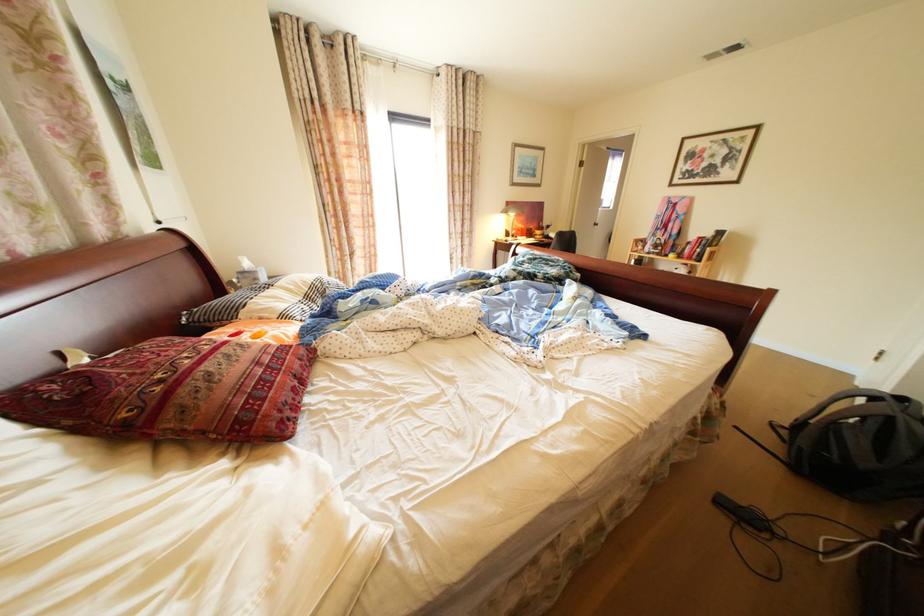
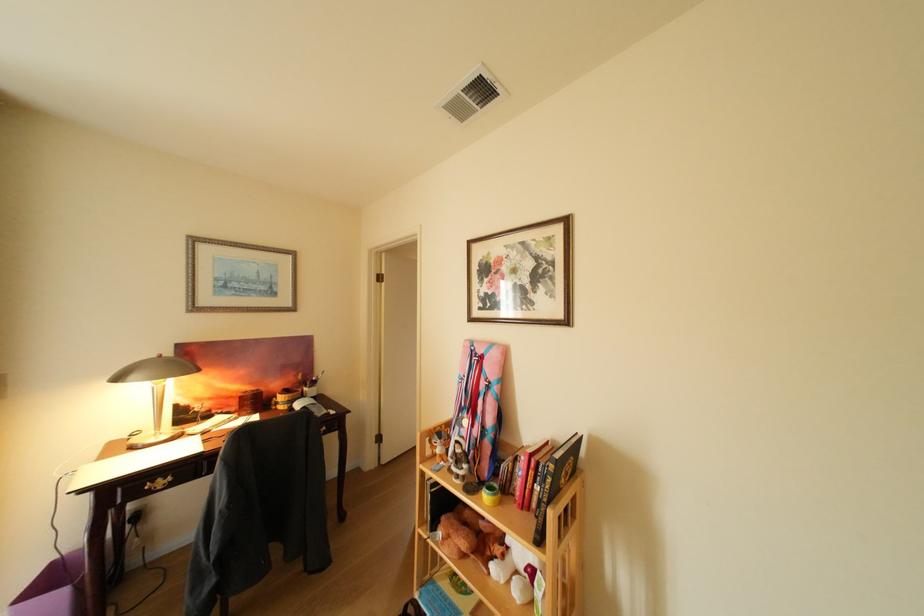
Locate, in the second image, the point that corresponds to the point at 532,228 in the first image.

(251, 389)